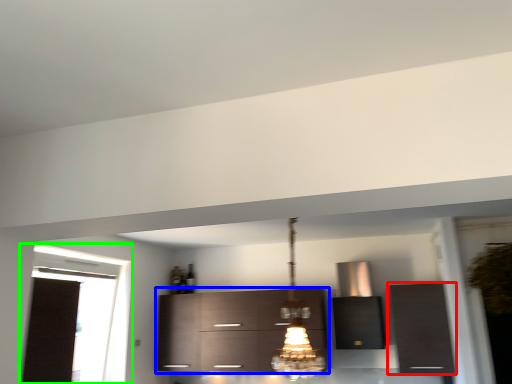
Question: Considering the real-world distances, which object is closest to cabinetry (highlighted by a red box)? cabinetry (highlighted by a blue box) or window (highlighted by a green box).

Choices:
 (A) cabinetry
 (B) window

Answer: (A)